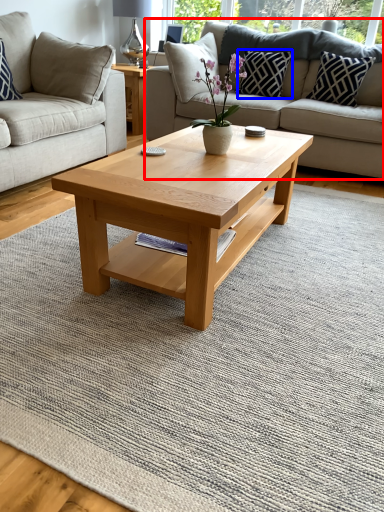
Question: Which point is further to the camera, studio couch (highlighted by a red box) or pillow (highlighted by a blue box)?

Choices:
 (A) studio couch
 (B) pillow

Answer: (B)